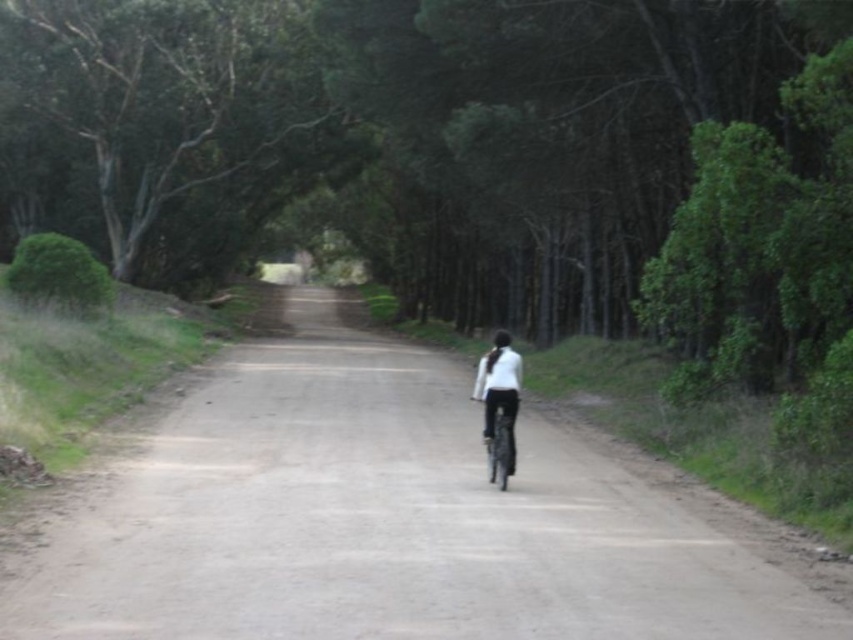
Is point (44, 522) in front of point (482, 376)?

Yes, it is in front of point (482, 376).

Which is above, dirt road at center or white matte jacket at center?

Positioned higher is white matte jacket at center.

Which is behind, point (543, 580) or point (497, 397)?

The point (497, 397) is behind.

Locate an element on the screen. dirt road at center is located at coordinates (381, 518).

Locate an element on the screen. white matte jacket at center is located at coordinates (498, 388).

Where is `white matte jacket at center`? white matte jacket at center is located at coordinates (498, 388).

Is dirt road at center shorter than shiny metallic bicycle at center?

Incorrect, dirt road at center's height does not fall short of shiny metallic bicycle at center's.

Does dirt road at center lie in front of shiny metallic bicycle at center?

That is True.

Where is `dirt road at center`? dirt road at center is located at coordinates (381, 518).